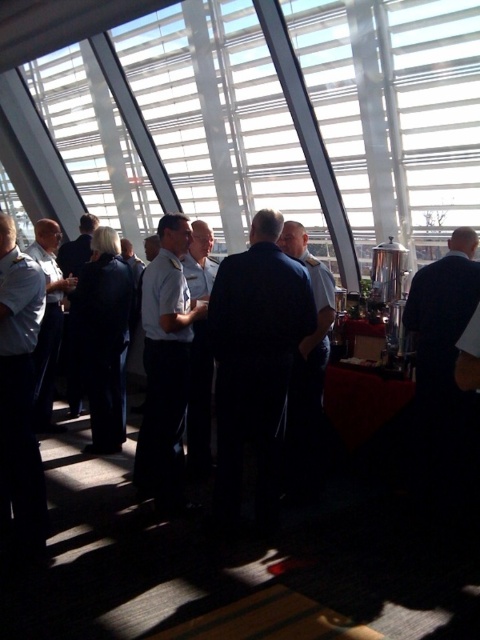
Question: Which is nearer to the dark blue suit at center?

Choices:
 (A) transparent glass window at center
 (B) light blue shirt at center

Answer: (B)

Question: Which object is farther from the camera taking this photo?

Choices:
 (A) dark blue suit at center
 (B) light blue uniform at center
 (C) transparent glass window at center
 (D) light blue uniform at left

Answer: (C)

Question: Which point appears closest to the camera in this image?

Choices:
 (A) (187, 276)
 (B) (440, 177)
 (C) (1, 241)

Answer: (C)

Question: Can you confirm if white shirt at center is bigger than light blue shirt at center?

Choices:
 (A) yes
 (B) no

Answer: (A)

Question: Is transparent glass window at center below white shirt at center?

Choices:
 (A) yes
 (B) no

Answer: (B)

Question: Does dark blue suit at center come in front of light blue uniform at center?

Choices:
 (A) yes
 (B) no

Answer: (A)